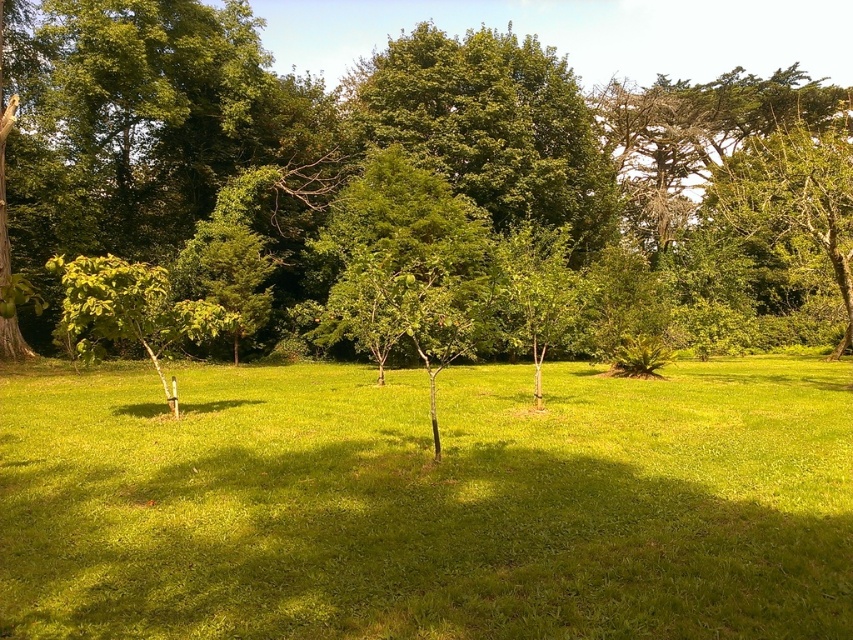
Question: Does green grass at center have a smaller size compared to green leafy tree at center?

Choices:
 (A) no
 (B) yes

Answer: (B)

Question: Which of these objects is positioned closest to the green leafy tree at left?

Choices:
 (A) green leafy tree at center
 (B) green grass at center

Answer: (B)

Question: Is green grass at center below green leafy tree at center?

Choices:
 (A) no
 (B) yes

Answer: (B)

Question: Which point appears farthest from the camera in this image?

Choices:
 (A) (724, 593)
 (B) (519, 125)
 (C) (129, 289)

Answer: (B)

Question: Based on their relative distances, which object is nearer to the green grass at center?

Choices:
 (A) green leafy tree at left
 (B) green leafy tree at center

Answer: (A)

Question: Is green grass at center closer to the viewer compared to green leafy tree at center?

Choices:
 (A) no
 (B) yes

Answer: (B)